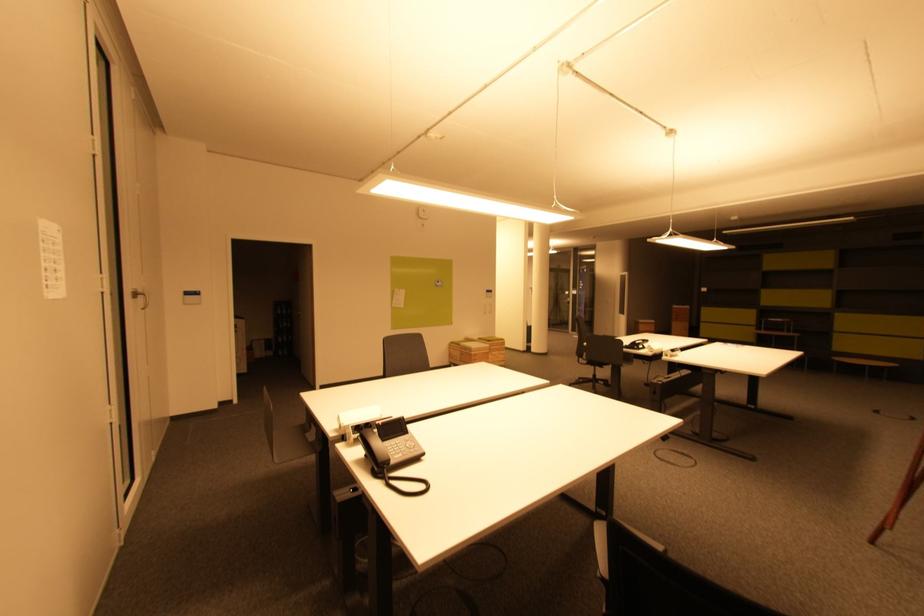
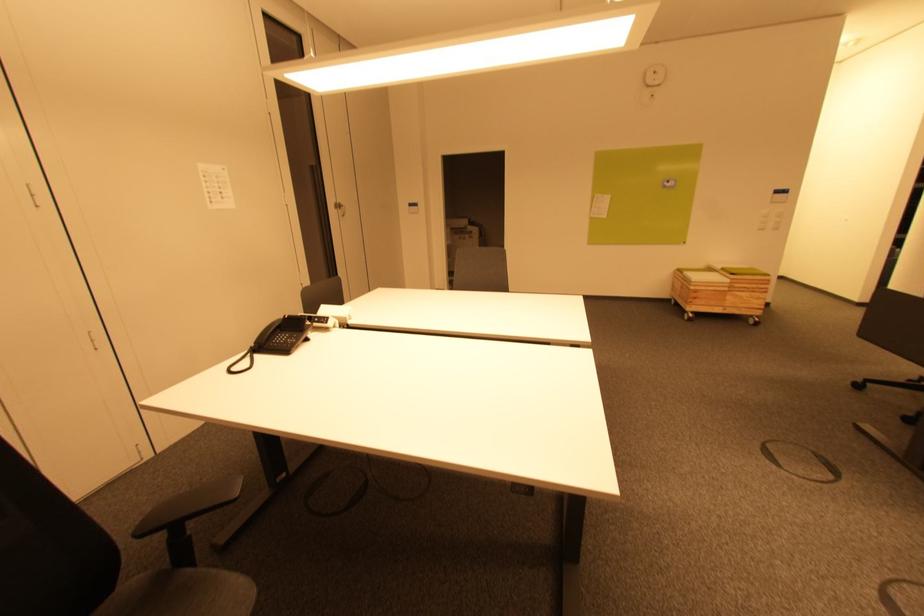
The point at (x=424, y=220) is marked in the first image. Where is the corresponding point in the second image?

(652, 87)